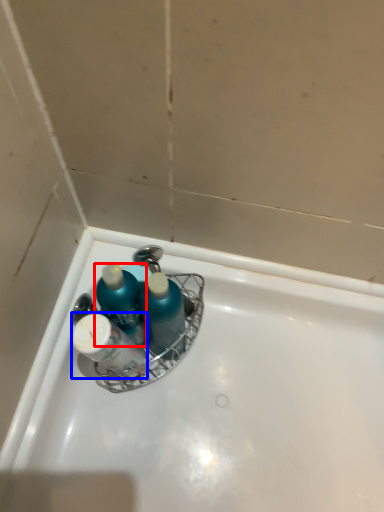
Question: Which point is closer to the camera, mouthwash (highlighted by a red box) or toiletry (highlighted by a blue box)?

Choices:
 (A) mouthwash
 (B) toiletry

Answer: (B)